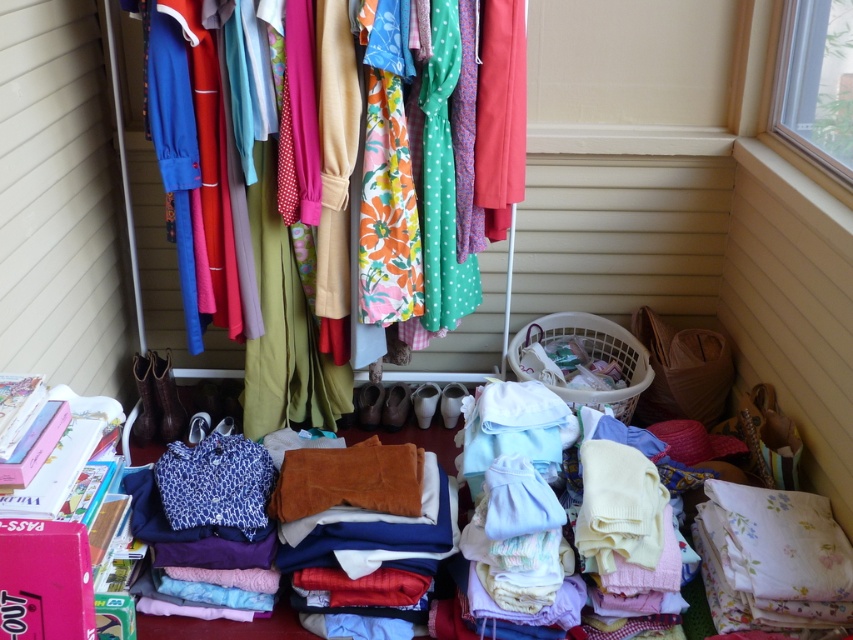
Question: Does matte fabric clothes at center have a greater width compared to white plastic laundry basket at lower center?

Choices:
 (A) yes
 (B) no

Answer: (B)

Question: Which point is closer to the camera?

Choices:
 (A) 556,337
 (B) 216,371

Answer: (B)

Question: Does matte fabric clothes at center lie behind white plastic laundry basket at lower center?

Choices:
 (A) no
 (B) yes

Answer: (B)

Question: Is matte fabric clothes at center wider than white plastic laundry basket at lower center?

Choices:
 (A) yes
 (B) no

Answer: (B)

Question: Which point is closer to the camera?

Choices:
 (A) white plastic laundry basket at lower center
 (B) matte fabric clothes at center

Answer: (A)